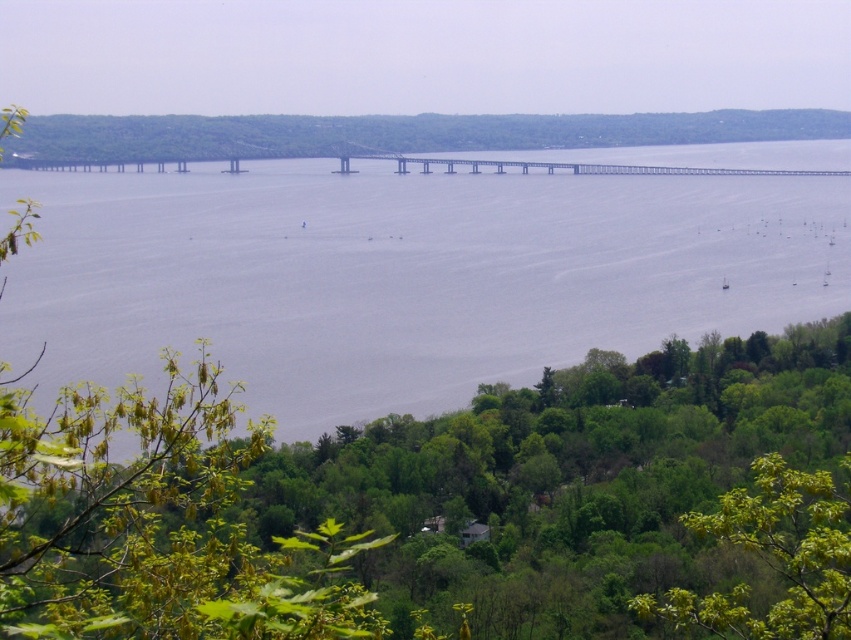
You are a photographer planning to capture the entire scene in one shot. Given that the gray water at center and the green leafy tree at lower right are both in your frame, which object will occupy more of the photo?

The gray water at center will occupy more of the photo because it is larger in size than the green leafy tree at lower right according to the description.

Consider the image. You are standing at the edge of the green leafy tree at lower right and want to cross to the other side of the gray water at center. Is the tree taller than the water to provide a safe crossing?

The gray water at center is taller than the green leafy tree at lower right, so the tree is not tall enough to provide a safe crossing over the water.

You are standing in the lush green area and want to take a photo of the metallic gray bridge at center without the green leafy tree at lower right blocking the view. Can you adjust your position to do so?

The green leafy tree at lower right is much taller than the metallic gray bridge at center, so moving further away from the tree or angling your camera downward might help avoid the obstruction.